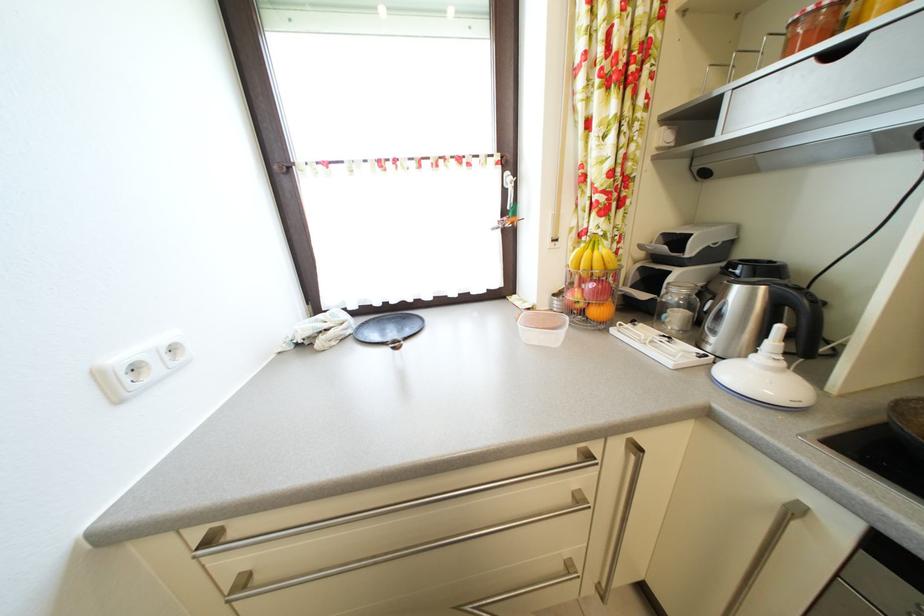
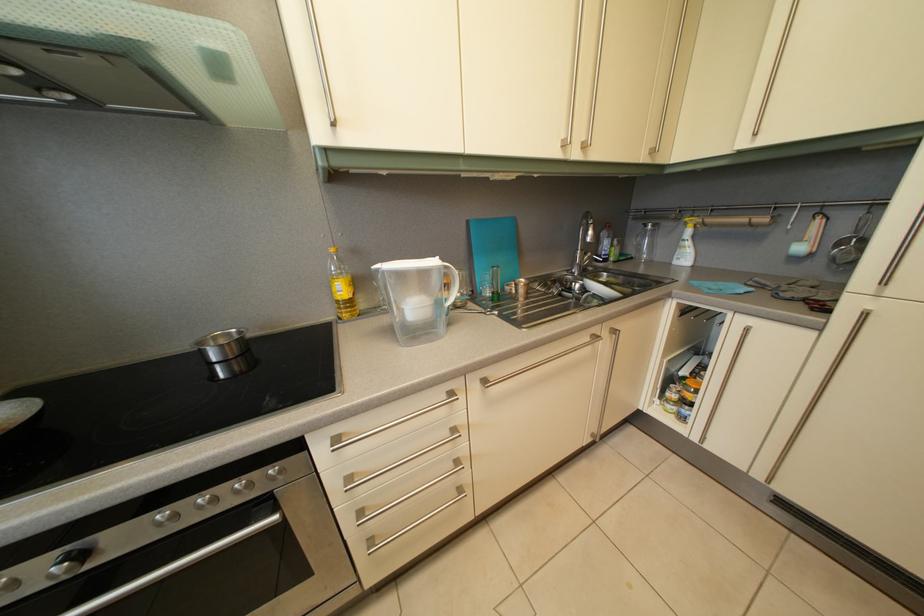
Consider the image. Based on the continuous images, in which direction is the camera rotating?

The rotation direction of the camera is right-down.